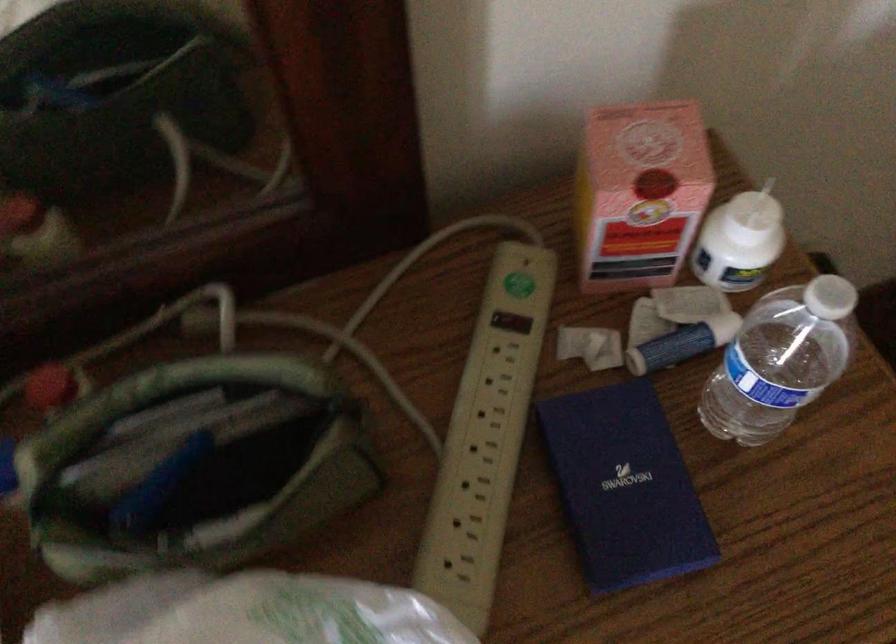
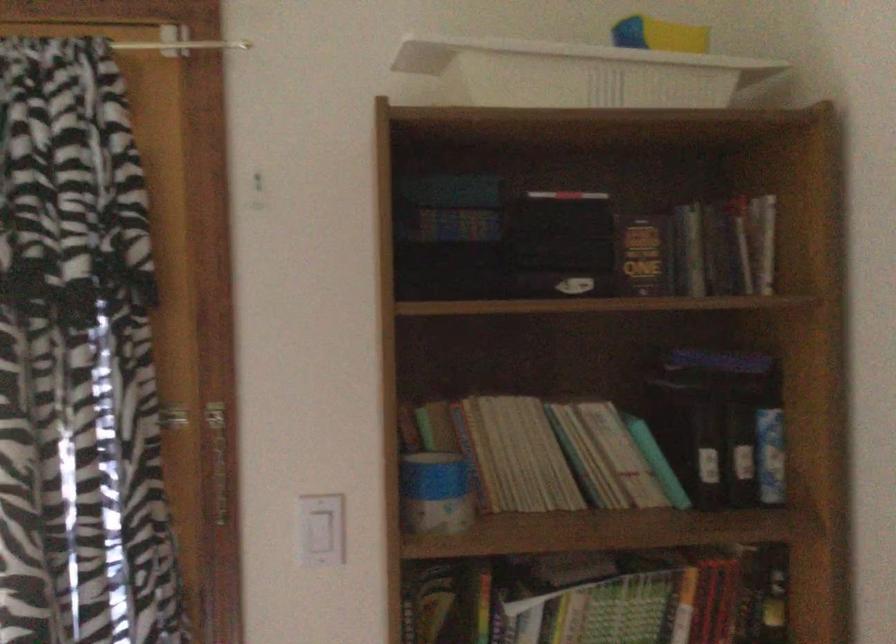
Question: The camera is either moving clockwise (left) or counter-clockwise (right) around the object. The first image is from the beginning of the video and the second image is from the end. Is the camera moving left or right when shooting the video?

Choices:
 (A) Left
 (B) Right

Answer: (B)